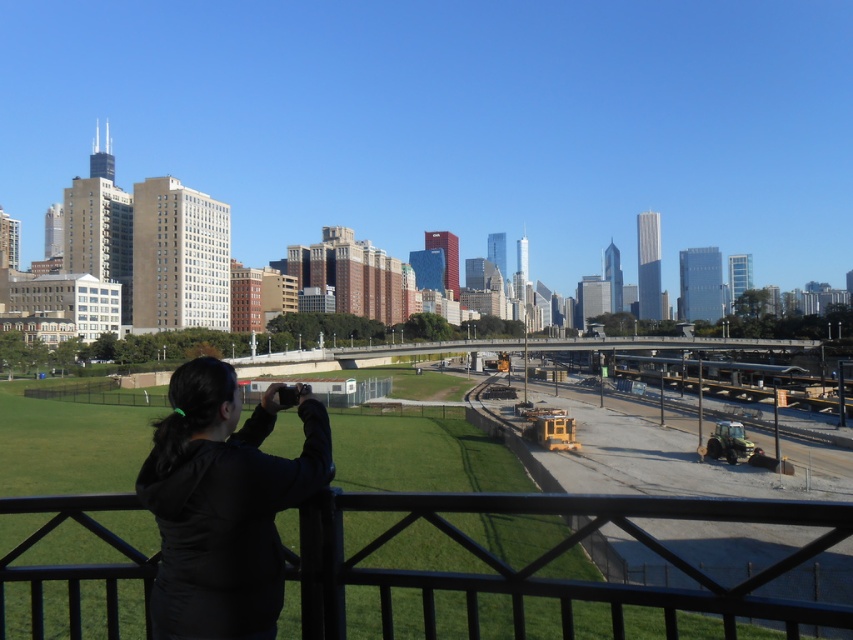
Consider the image. Which is more to the right, black metal/rail at lower center or black fabric at left?

From the viewer's perspective, black fabric at left appears more on the right side.

Who is more distant from viewer, (695, 600) or (172, 552)?

Point (172, 552)

What do you see at coordinates (547, 561) in the screenshot? I see `black metal/rail at lower center` at bounding box center [547, 561].

The height and width of the screenshot is (640, 853). Identify the location of black metal/rail at lower center. (547, 561).